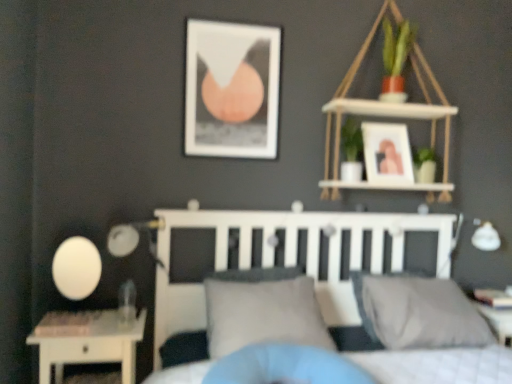
Question: From a real-world perspective, is gray fabric pillow at center, the first pillow positioned from the left, physically located above or below matte white picture frame at upper right, the 1th picture frame in the right-to-left sequence?

Choices:
 (A) above
 (B) below

Answer: (B)

Question: Is gray fabric pillow at center, which is the 2th pillow from right to left, taller or shorter than matte white picture frame at upper right, the 1th picture frame in the right-to-left sequence?

Choices:
 (A) short
 (B) tall

Answer: (A)

Question: Considering the real-world distances, which object is farthest from the matte black picture frame at upper center, which is counted as the 1th picture frame, starting from the left?

Choices:
 (A) matte white picture frame at upper right, the 1th picture frame in the right-to-left sequence
 (B) white wood shelf at upper right
 (C) white matte bed at center
 (D) gray fabric pillow at center, which ranks as the 1th pillow in right-to-left order
 (E) matte black table lamp at left

Answer: (D)

Question: Which is nearer to the gray fabric pillow at center, which ranks as the 1th pillow in right-to-left order?

Choices:
 (A) white wood shelf at upper right
 (B) matte black table lamp at left
 (C) gray fabric pillow at center, the first pillow positioned from the left
 (D) matte white picture frame at upper right, the 1th picture frame in the right-to-left sequence
 (E) white matte bed at center

Answer: (E)